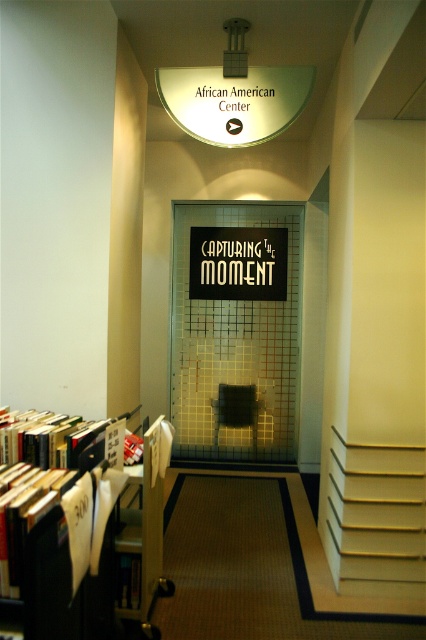
Question: Observing the image, what is the correct spatial positioning of transparent glass elevator at center in reference to white paper-covered books at left?

Choices:
 (A) left
 (B) right

Answer: (B)

Question: Which of these objects is positioned closest to the matte glass sign at upper center?

Choices:
 (A) transparent glass elevator at center
 (B) black matte sign at center
 (C) hardcover book at lower left

Answer: (B)

Question: In this image, where is transparent glass elevator at center located relative to white/yellow stair at right?

Choices:
 (A) above
 (B) below

Answer: (A)

Question: Which point is closer to the camera?

Choices:
 (A) (195, 358)
 (B) (115, 573)
 (C) (360, 465)

Answer: (B)

Question: Which of the following is the farthest from the observer?

Choices:
 (A) black matte sign at center
 (B) white/yellow stair at right
 (C) transparent glass elevator at center
 (D) matte black chair at center

Answer: (A)

Question: Is white paper-covered books at left wider than black matte sign at center?

Choices:
 (A) yes
 (B) no

Answer: (B)